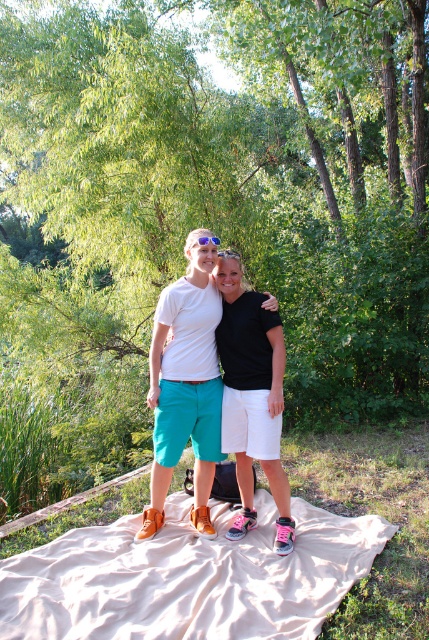
Measure the distance between beige fabric blanket at lower center and blue reflective lens sunglasses at center.

beige fabric blanket at lower center is 2.25 meters away from blue reflective lens sunglasses at center.

The width and height of the screenshot is (429, 640). What do you see at coordinates (189, 577) in the screenshot?
I see `beige fabric blanket at lower center` at bounding box center [189, 577].

Is point (45, 579) positioned in front of point (205, 234)?

Yes, point (45, 579) is in front of point (205, 234).

Find the location of a particular element. beige fabric blanket at lower center is located at coordinates (189, 577).

Where is `matte teal shorts at center`? Image resolution: width=429 pixels, height=640 pixels. matte teal shorts at center is located at coordinates (187, 387).

Is matte teal shorts at center bigger than black matte shorts at center?

Yes.

Identify the location of matte teal shorts at center. The image size is (429, 640). (187, 387).

Locate an element on the screen. The image size is (429, 640). matte teal shorts at center is located at coordinates (187, 387).

Is point (283, 602) behind point (196, 477)?

No, (283, 602) is in front of (196, 477).

Between beige fabric blanket at lower center and matte teal shorts at center, which one has more height?

Standing taller between the two is matte teal shorts at center.

Is point (165, 572) behind point (201, 448)?

No, it is not.

Find the location of a particular element. beige fabric blanket at lower center is located at coordinates pos(189,577).